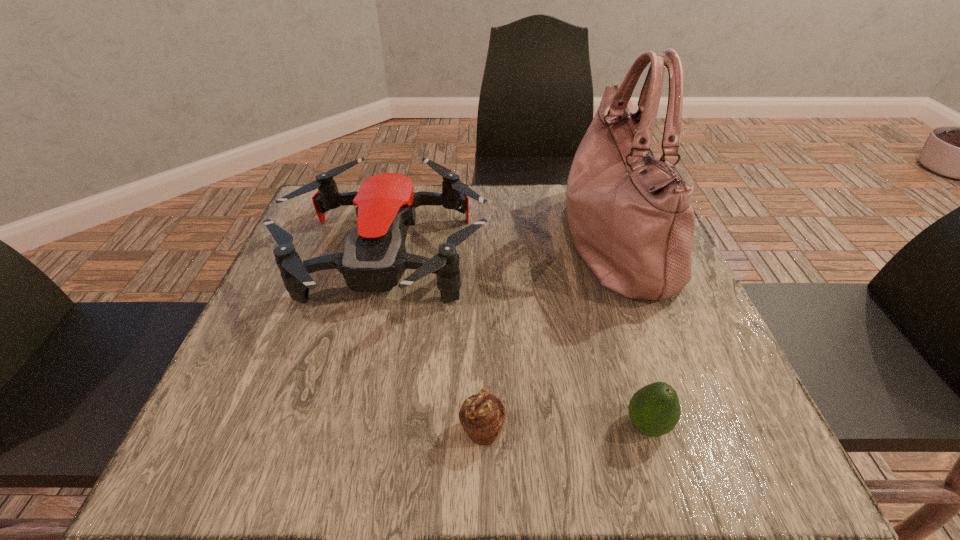
Where is `handbag`? handbag is located at coordinates (631, 220).

This screenshot has width=960, height=540. What are the coordinates of `the third shortest object` in the screenshot? It's located at tap(374, 258).

Locate an element on the screen. The height and width of the screenshot is (540, 960). avocado is located at coordinates (654, 410).

Identify the location of muffin. (482, 415).

Locate an element on the screen. The image size is (960, 540). vacant space positioned at the front of the tallest object with handles is located at coordinates (503, 241).

I want to click on vacant space located at the front of the tallest object with handles, so click(x=540, y=241).

Identify the location of vacant space located 0.060m at the front of the tallest object with handles. Image resolution: width=960 pixels, height=540 pixels. (536, 241).

The height and width of the screenshot is (540, 960). Find the location of `vacant space located on the camera side of the drone`. vacant space located on the camera side of the drone is located at coordinates (343, 443).

Find the location of a particular element. This screenshot has height=540, width=960. vacant space situated on the left of the avocado is located at coordinates (544, 426).

Locate an element on the screen. The image size is (960, 540). free region located on the right of the muffin is located at coordinates (598, 431).